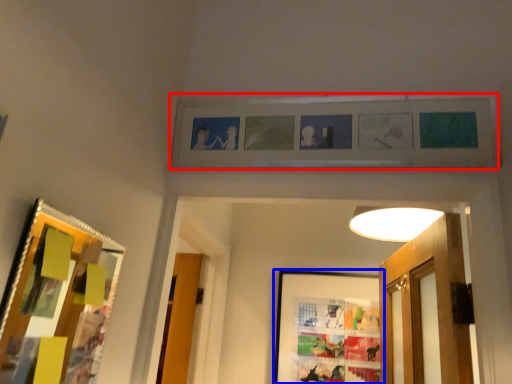
Question: Which object is closer to the camera taking this photo, picture frame (highlighted by a red box) or picture frame (highlighted by a blue box)?

Choices:
 (A) picture frame
 (B) picture frame

Answer: (A)